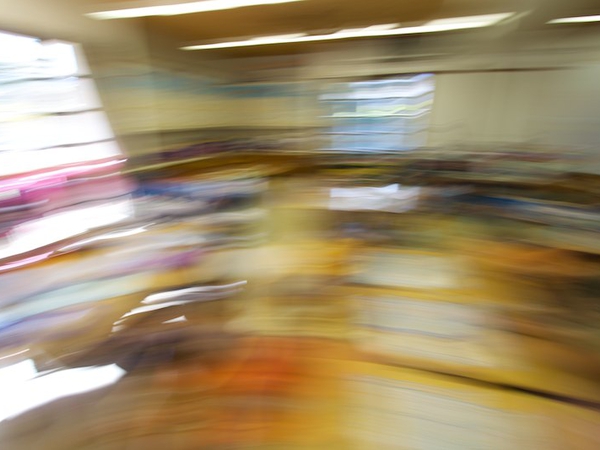
You are a GUI agent. You are given a task and a screenshot of the screen. Output one action in this format:
    pyautogui.click(x=<x>, y=<y>)
    Task: Click on the wall
    The height and width of the screenshot is (450, 600).
    Given the screenshot: What is the action you would take?
    tap(505, 99)